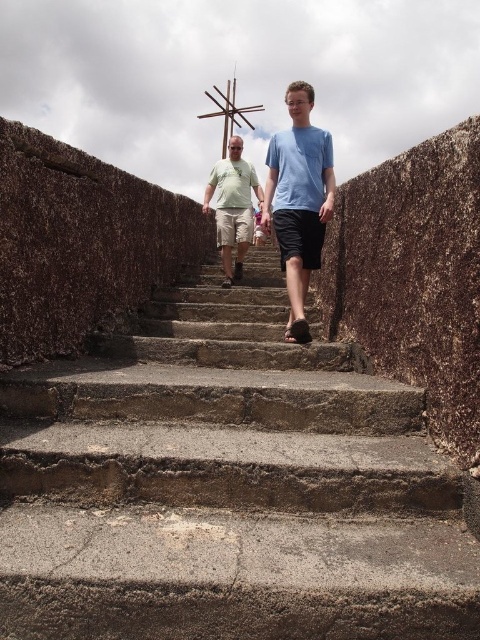
Question: Which point is farther to the camera?

Choices:
 (A) light blue t-shirt at center
 (B) concrete stairs at center

Answer: (A)

Question: Does concrete stairs at center have a smaller size compared to matte green t-shirt at center?

Choices:
 (A) yes
 (B) no

Answer: (A)

Question: Is light blue t-shirt at center to the right of wooden cross at center from the viewer's perspective?

Choices:
 (A) yes
 (B) no

Answer: (A)

Question: Is the position of light blue t-shirt at center more distant than that of matte green t-shirt at center?

Choices:
 (A) no
 (B) yes

Answer: (A)

Question: Estimate the real-world distances between objects in this image. Which object is closer to the concrete stairs at center?

Choices:
 (A) light blue t-shirt at center
 (B) wooden cross at center

Answer: (A)

Question: Which is nearer to the matte green t-shirt at center?

Choices:
 (A) concrete stairs at center
 (B) light blue t-shirt at center

Answer: (B)